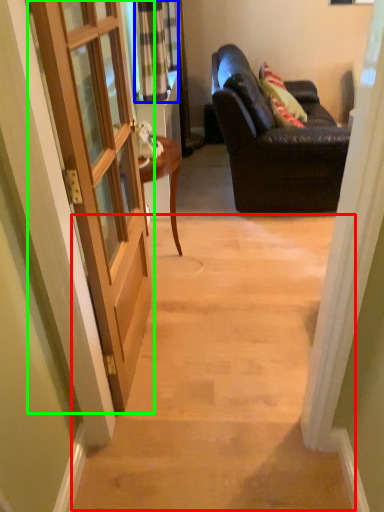
Question: Which object is positioned farthest from stairwell (highlighted by a red box)? Select from curtain (highlighted by a blue box) and door (highlighted by a green box).

Choices:
 (A) curtain
 (B) door

Answer: (A)